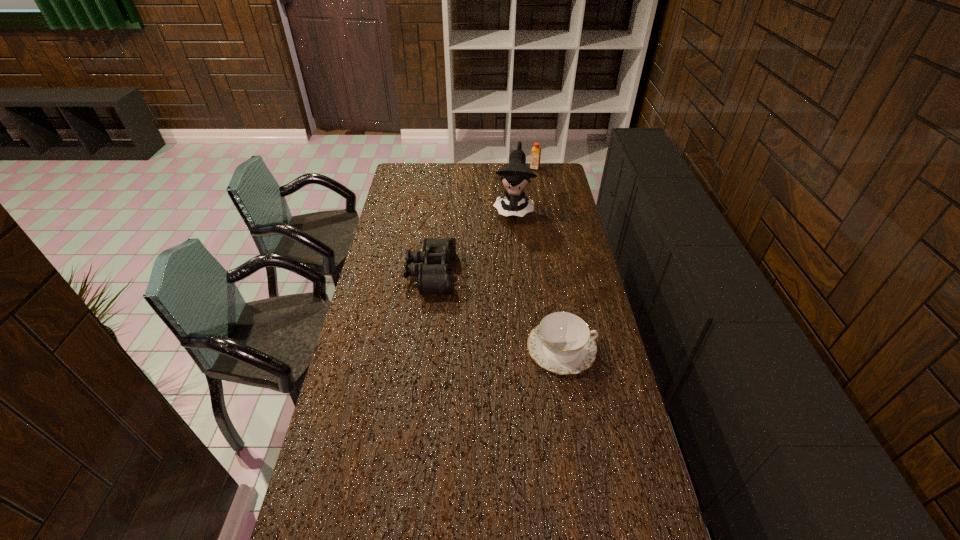
I want to click on binoculars, so click(434, 276).

Where is `the third farthest object`? the third farthest object is located at coordinates pos(434,276).

The image size is (960, 540). Identify the location of the nearest object. (562, 343).

What are the coordinates of `the shortest object` in the screenshot? It's located at (x=562, y=343).

Locate an element on the screen. The height and width of the screenshot is (540, 960). the second farthest object is located at coordinates (515, 176).

I want to click on doll, so click(x=515, y=176).

Where is `orange juice`? The width and height of the screenshot is (960, 540). orange juice is located at coordinates (535, 158).

Where is `the farthest object`? This screenshot has height=540, width=960. the farthest object is located at coordinates (535, 158).

This screenshot has height=540, width=960. What are the coordinates of `blank area located at the eyepieces of the third farthest object` in the screenshot? It's located at (533, 274).

Identify the location of free space located at the face of the tallest object. The width and height of the screenshot is (960, 540). (508, 249).